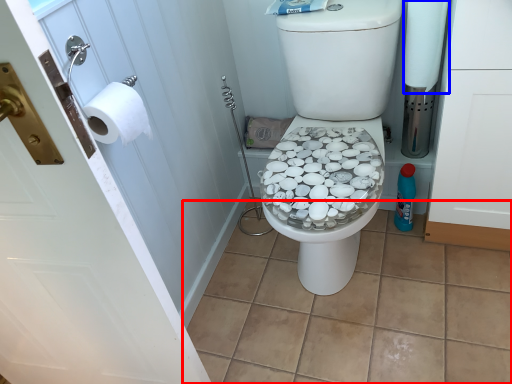
Question: Among these objects, which one is farthest to the camera, tile (highlighted by a red box) or toilet paper (highlighted by a blue box)?

Choices:
 (A) tile
 (B) toilet paper

Answer: (B)